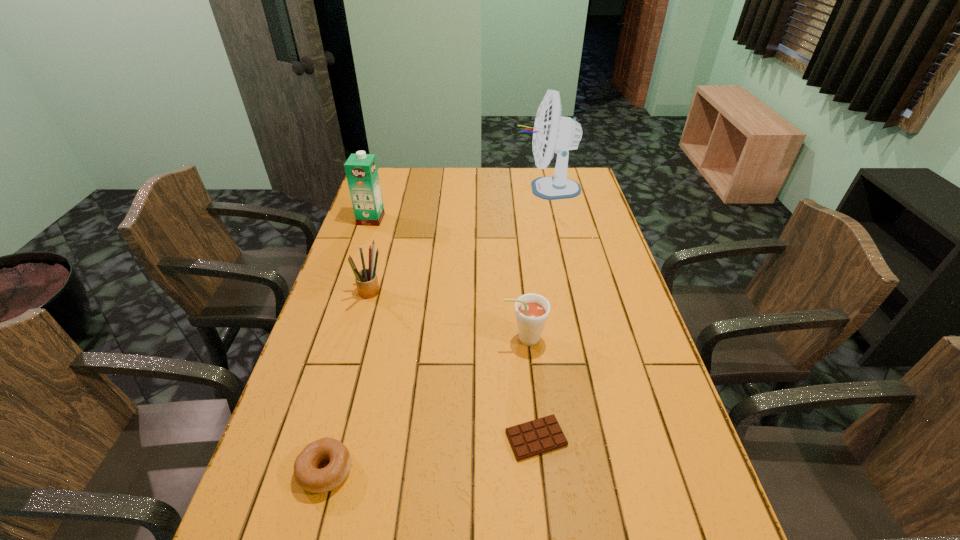
The width and height of the screenshot is (960, 540). In order to click on pencil box located at the left edge in this screenshot , I will do `click(367, 284)`.

Locate an element on the screen. bagel located in the left edge section of the desktop is located at coordinates [x=306, y=473].

Where is `object at the right edge`? This screenshot has height=540, width=960. object at the right edge is located at coordinates (552, 132).

At what (x,y) coordinates should I click in order to perform the action: click on object that is at the far right corner. Please return your answer as a coordinate pair (x, y). This screenshot has height=540, width=960. Looking at the image, I should click on (552, 132).

This screenshot has height=540, width=960. What are the coordinates of `blank area at the far edge` in the screenshot? It's located at (502, 180).

Image resolution: width=960 pixels, height=540 pixels. Find the location of `free space at the left edge`. free space at the left edge is located at coordinates (350, 329).

This screenshot has height=540, width=960. I want to click on free space at the right edge of the desktop, so click(599, 243).

Identify the location of vacant space that is in between the fan and the second shortest object. The image size is (960, 540). (436, 329).

Identify the location of free space between the shortest object and the pencil box. (453, 366).

You are a GUI agent. You are given a task and a screenshot of the screen. Output one action in this format:
    pyautogui.click(x=<x>, y=<y>)
    Task: Click on the vacant area that lies between the farthest object and the bagel
    Image resolution: width=960 pixels, height=540 pixels.
    Given the screenshot: What is the action you would take?
    pyautogui.click(x=436, y=329)